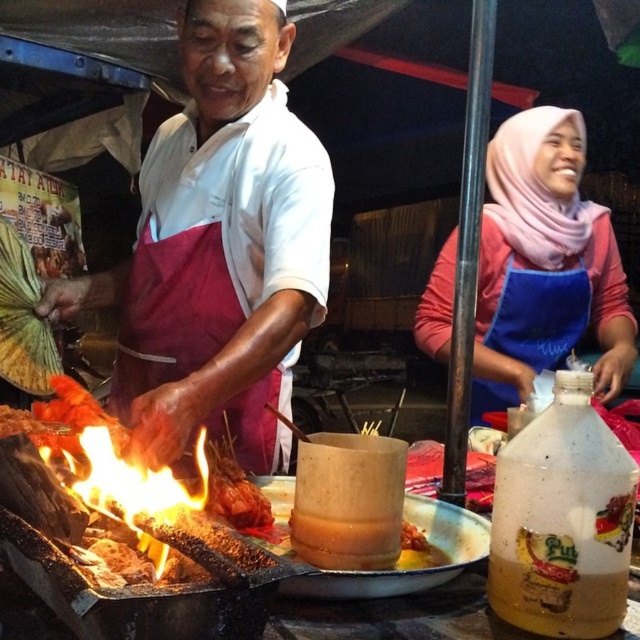
Question: Is pink fabric hijab at upper right to the right of translucent plastic bottle at center-right from the viewer's perspective?

Choices:
 (A) no
 (B) yes

Answer: (B)

Question: Estimate the real-world distances between objects in this image. Which object is farther from the translucent plastic bottle at center-right?

Choices:
 (A) white matte apron at center
 (B) pink fabric hijab at upper right

Answer: (B)

Question: Is pink fabric hijab at upper right below translucent plastic bottle at center-right?

Choices:
 (A) no
 (B) yes

Answer: (A)

Question: Can you confirm if pink fabric hijab at upper right is smaller than translucent plastic bottle at center-right?

Choices:
 (A) yes
 (B) no

Answer: (B)

Question: Which of these objects is positioned farthest from the pink fabric hijab at upper right?

Choices:
 (A) translucent plastic bottle at center-right
 (B) white matte apron at center

Answer: (A)

Question: Estimate the real-world distances between objects in this image. Which object is closer to the pink fabric hijab at upper right?

Choices:
 (A) translucent plastic bottle at center-right
 (B) white matte apron at center

Answer: (B)